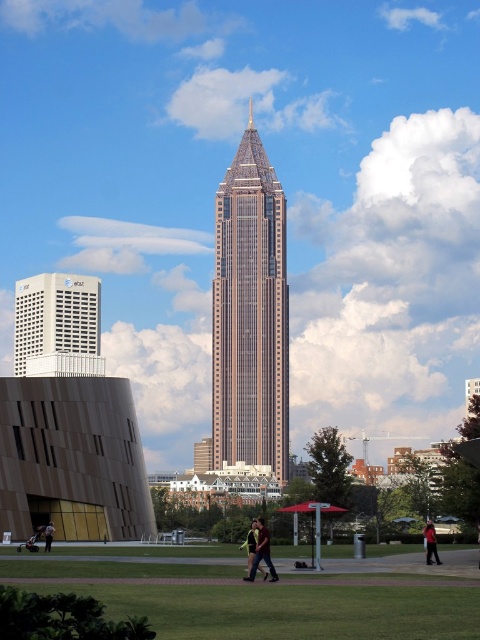
Question: Is dark brown leather jacket at center further to camera compared to red shirt at lower right?

Choices:
 (A) yes
 (B) no

Answer: (B)

Question: Which point is farther to the camera?

Choices:
 (A) (71, 326)
 (B) (223, 396)
 (C) (249, 547)
 (D) (46, 540)

Answer: (D)

Question: Estimate the real-world distances between objects in this image. Which object is closer to the dark brown leather jacket at center?

Choices:
 (A) dark brown leather jacket at lower left
 (B) red shirt at lower right
 (C) white matte building at lower left

Answer: (B)

Question: From the image, what is the correct spatial relationship of gold-tipped glass skyscraper at center in relation to dark brown leather jacket at lower left?

Choices:
 (A) above
 (B) below

Answer: (A)

Question: Which object is closer to the camera taking this photo?

Choices:
 (A) white matte building at lower left
 (B) dark brown leather jacket at center

Answer: (B)

Question: Can you confirm if white matte building at lower left is positioned to the right of red shirt at lower right?

Choices:
 (A) no
 (B) yes

Answer: (A)